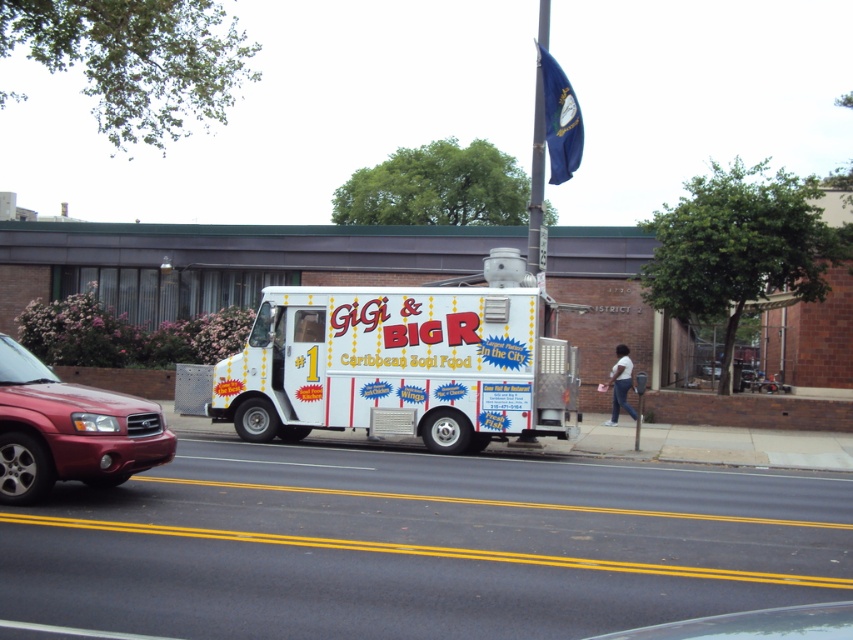
Which is more to the left, white glossy food truck at center or metallic pole at upper center?

From the viewer's perspective, white glossy food truck at center appears more on the left side.

Does white glossy food truck at center appear on the left side of metallic pole at upper center?

Yes, white glossy food truck at center is to the left of metallic pole at upper center.

Who is more distant from viewer, (x=316, y=305) or (x=543, y=170)?

Positioned behind is point (x=543, y=170).

I want to click on white glossy food truck at center, so click(x=402, y=364).

Who is shorter, white glossy food truck at center or metallic red suv at left?

metallic red suv at left

Who is more distant from viewer, (225,381) or (19,348)?

The point (225,381) is behind.

Is point (488, 305) closer to camera compared to point (169, 435)?

No, it is behind (169, 435).

The height and width of the screenshot is (640, 853). What are the coordinates of `white glossy food truck at center` in the screenshot? It's located at (402, 364).

Is point (78, 442) positioned behind point (532, 195)?

No, (78, 442) is in front of (532, 195).

Can you confirm if metallic red suv at left is wider than metallic pole at upper center?

In fact, metallic red suv at left might be narrower than metallic pole at upper center.

Describe the element at coordinates (68, 429) in the screenshot. This screenshot has height=640, width=853. I see `metallic red suv at left` at that location.

Find the location of a particular element. The image size is (853, 640). metallic red suv at left is located at coordinates (68, 429).